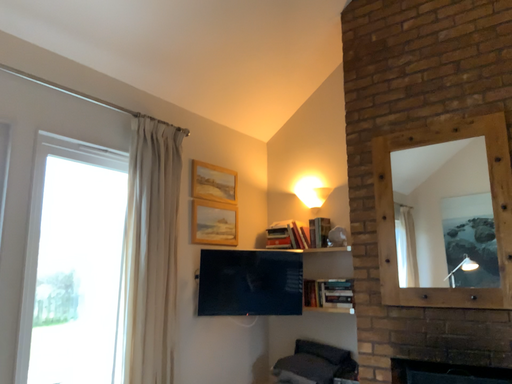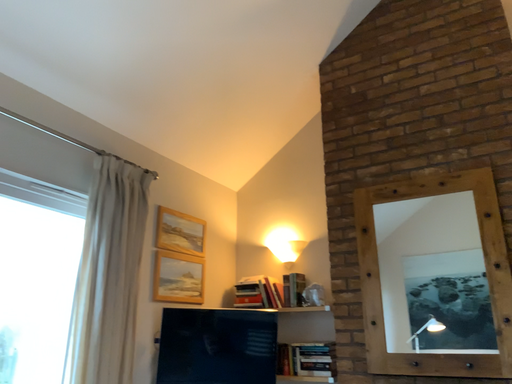
Question: How did the camera likely rotate when shooting the video?

Choices:
 (A) rotated right
 (B) rotated left

Answer: (A)